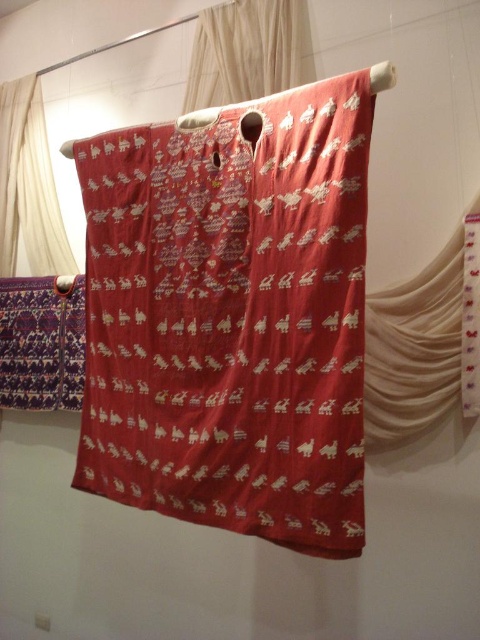
Question: Does silky red fabric at center appear over silky white curtain at left?

Choices:
 (A) no
 (B) yes

Answer: (A)

Question: Is silky red fabric at center smaller than matte white curtain at right?

Choices:
 (A) no
 (B) yes

Answer: (A)

Question: Considering the real-world distances, which object is closest to the silky white curtain at left?

Choices:
 (A) silky red fabric at center
 (B) matte white curtain at right

Answer: (A)

Question: Among these objects, which one is farthest from the camera?

Choices:
 (A) silky red fabric at center
 (B) silky white curtain at upper center

Answer: (B)

Question: Estimate the real-world distances between objects in this image. Which object is closer to the silky white curtain at upper center?

Choices:
 (A) silky red fabric at center
 (B) matte white curtain at right
 (C) silky white curtain at left

Answer: (A)

Question: Where is matte white curtain at right located in relation to silky white curtain at upper center in the image?

Choices:
 (A) right
 (B) left

Answer: (A)